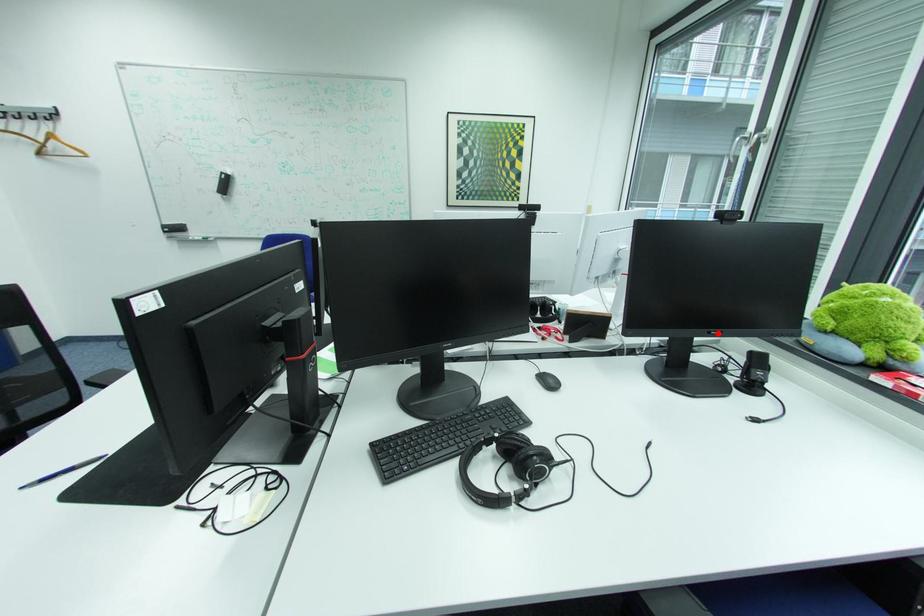
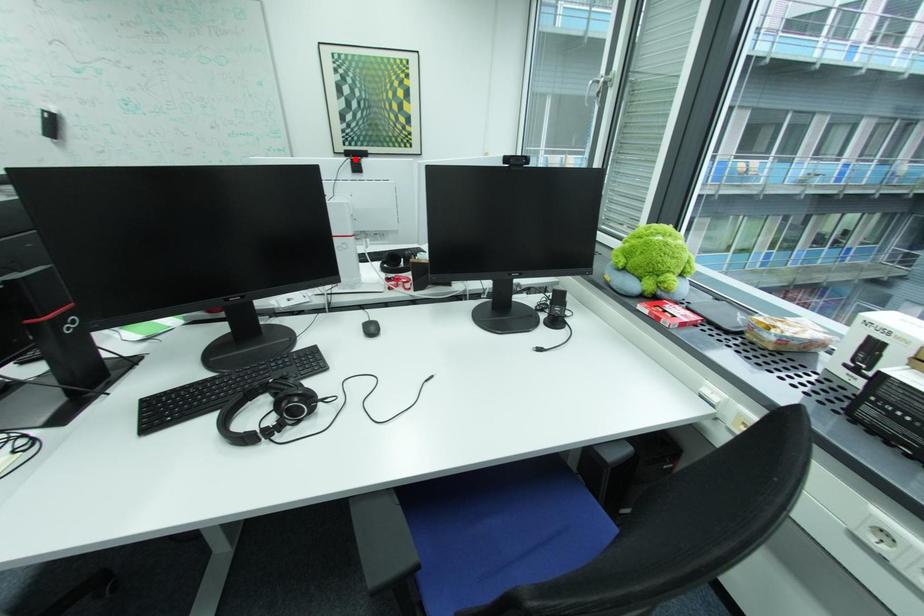
I am providing you with two images of the same scene from different viewpoints. A red point is marked on the first image and another point is marked on the second image. Does the point marked in image1 correspond to the same location as the one in image2?

No